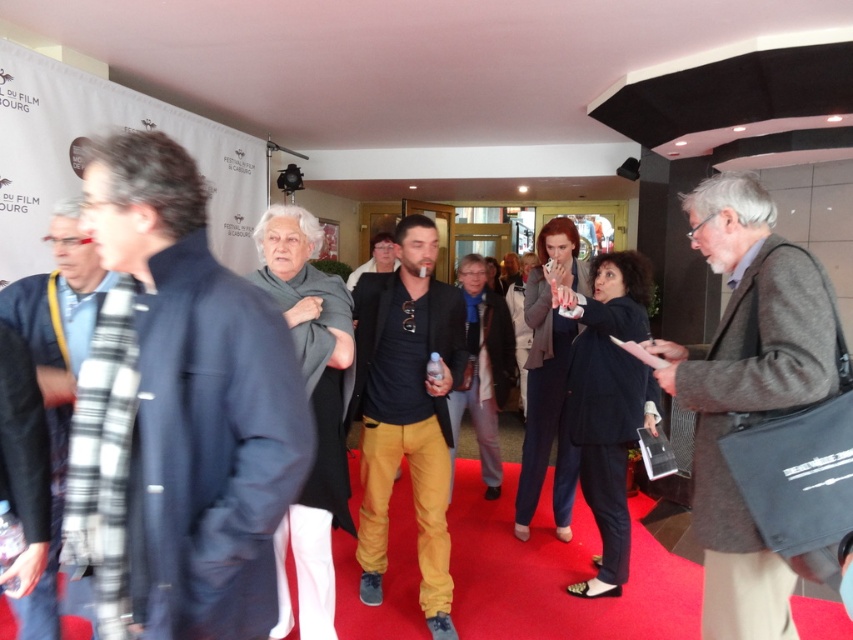
Which is more to the left, matte black shirt at center or plaid scarf at left?

plaid scarf at left

The height and width of the screenshot is (640, 853). In order to click on matte black shirt at center in this screenshot , I will do `click(407, 410)`.

The width and height of the screenshot is (853, 640). Describe the element at coordinates (407, 410) in the screenshot. I see `matte black shirt at center` at that location.

Identify the location of matte black shirt at center. The image size is (853, 640). (407, 410).

Is point (28, 314) closer to viewer compared to point (352, 273)?

Yes, it is.

Does plaid scarf at left appear on the right side of black leather jacket at center?

Incorrect, plaid scarf at left is not on the right side of black leather jacket at center.

At what (x,y) coordinates should I click in order to perform the action: click on plaid scarf at left. Please return your answer as a coordinate pair (x, y). Looking at the image, I should click on (57, 385).

Is gray wool coat at right wider than matte black shirt at center?

In fact, gray wool coat at right might be narrower than matte black shirt at center.

Between gray wool coat at right and matte black shirt at center, which one appears on the right side from the viewer's perspective?

From the viewer's perspective, gray wool coat at right appears more on the right side.

What do you see at coordinates (746, 394) in the screenshot?
I see `gray wool coat at right` at bounding box center [746, 394].

Image resolution: width=853 pixels, height=640 pixels. Identify the location of gray wool coat at right. (746, 394).